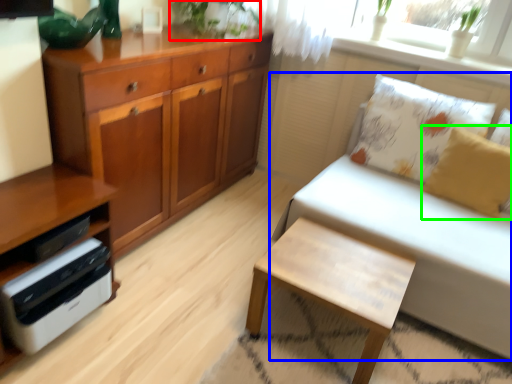
Question: Estimate the real-world distances between objects in this image. Which object is closer to plant (highlighted by a red box), studio couch (highlighted by a blue box) or pillow (highlighted by a green box)?

Choices:
 (A) studio couch
 (B) pillow

Answer: (A)